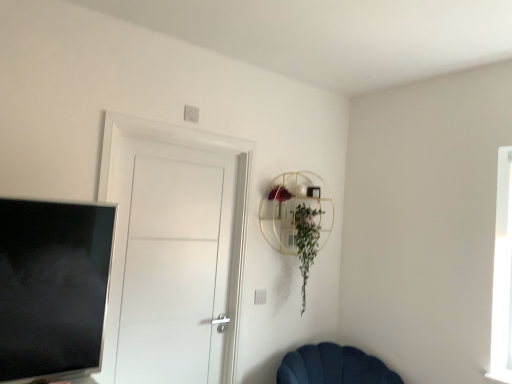
Question: From a real-world perspective, is green leafy plant at upper center beneath white matte door at center?

Choices:
 (A) yes
 (B) no

Answer: (B)

Question: Considering the relative sizes of green leafy plant at upper center and white matte door at center in the image provided, is green leafy plant at upper center bigger than white matte door at center?

Choices:
 (A) yes
 (B) no

Answer: (B)

Question: Would you say green leafy plant at upper center is a long distance from white matte door at center?

Choices:
 (A) no
 (B) yes

Answer: (A)

Question: Can you confirm if green leafy plant at upper center is wider than white matte door at center?

Choices:
 (A) yes
 (B) no

Answer: (A)

Question: Considering the relative sizes of green leafy plant at upper center and white matte door at center in the image provided, is green leafy plant at upper center taller than white matte door at center?

Choices:
 (A) yes
 (B) no

Answer: (B)

Question: Would you say green leafy plant at upper center contains white matte door at center?

Choices:
 (A) no
 (B) yes

Answer: (A)

Question: Is green leafy plant at upper center oriented away from velvet dark blue chair at lower center?

Choices:
 (A) no
 (B) yes

Answer: (A)

Question: Does green leafy plant at upper center turn towards velvet dark blue chair at lower center?

Choices:
 (A) yes
 (B) no

Answer: (B)

Question: Is green leafy plant at upper center in contact with velvet dark blue chair at lower center?

Choices:
 (A) no
 (B) yes

Answer: (A)

Question: Can velvet dark blue chair at lower center be found inside green leafy plant at upper center?

Choices:
 (A) no
 (B) yes

Answer: (A)

Question: Can you confirm if green leafy plant at upper center is wider than velvet dark blue chair at lower center?

Choices:
 (A) no
 (B) yes

Answer: (A)

Question: Does green leafy plant at upper center appear on the left side of velvet dark blue chair at lower center?

Choices:
 (A) no
 (B) yes

Answer: (B)

Question: Is silver metallic tv at left smaller than velvet dark blue chair at lower center?

Choices:
 (A) no
 (B) yes

Answer: (B)